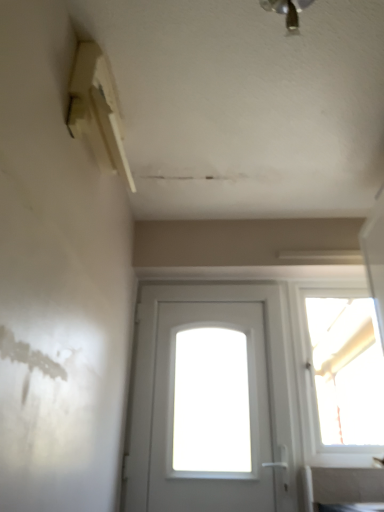
Question: Is white matte door at center positioned far away from metallic ceiling light at upper center?

Choices:
 (A) no
 (B) yes

Answer: (B)

Question: From a real-world perspective, is white matte door at center beneath metallic ceiling light at upper center?

Choices:
 (A) no
 (B) yes

Answer: (B)

Question: Is white matte door at center bigger than metallic ceiling light at upper center?

Choices:
 (A) no
 (B) yes

Answer: (B)

Question: Is white matte door at center positioned before metallic ceiling light at upper center?

Choices:
 (A) yes
 (B) no

Answer: (B)

Question: Can you confirm if white matte door at center is smaller than metallic ceiling light at upper center?

Choices:
 (A) yes
 (B) no

Answer: (B)

Question: From a real-world perspective, is transparent glass window at upper right physically located above or below white matte door at center?

Choices:
 (A) above
 (B) below

Answer: (A)

Question: In the image, is transparent glass window at upper right positioned in front of or behind white matte door at center?

Choices:
 (A) behind
 (B) front

Answer: (A)

Question: Does point tap(375, 332) appear closer or farther from the camera than point tap(150, 313)?

Choices:
 (A) closer
 (B) farther

Answer: (A)

Question: From the image's perspective, is transparent glass window at upper right positioned above or below white matte door at center?

Choices:
 (A) above
 (B) below

Answer: (A)

Question: From the image's perspective, is transparent glass window at upper right positioned above or below metallic ceiling light at upper center?

Choices:
 (A) above
 (B) below

Answer: (B)

Question: Would you say transparent glass window at upper right is inside or outside metallic ceiling light at upper center?

Choices:
 (A) outside
 (B) inside

Answer: (A)

Question: In the image, is transparent glass window at upper right on the left side or the right side of metallic ceiling light at upper center?

Choices:
 (A) left
 (B) right

Answer: (B)

Question: Looking at their shapes, would you say transparent glass window at upper right is wider or thinner than metallic ceiling light at upper center?

Choices:
 (A) wide
 (B) thin

Answer: (B)

Question: Is point (297, 10) positioned closer to the camera than point (347, 417)?

Choices:
 (A) closer
 (B) farther

Answer: (A)

Question: From a real-world perspective, is metallic ceiling light at upper center positioned above or below transparent glass window at upper right?

Choices:
 (A) below
 (B) above

Answer: (B)